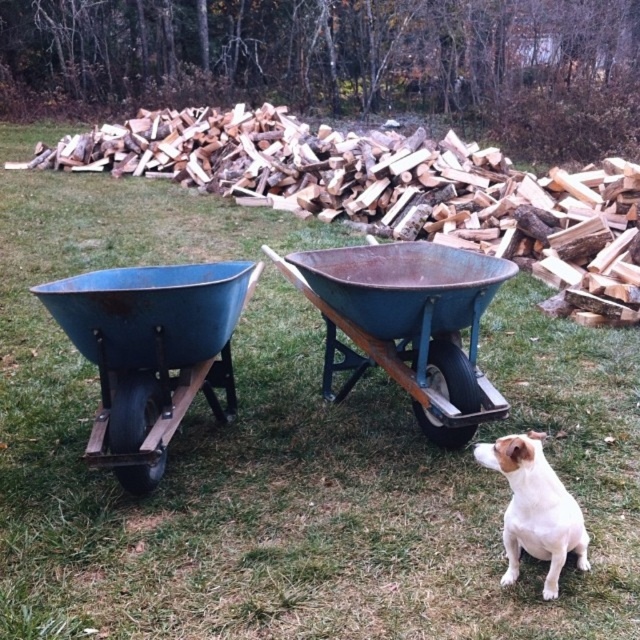
You are trying to decide which wheelbarrow to use for carrying heavy logs. Considering their sizes, which one between the blue metal wheelbarrow at left and the rusty metal wheelbarrow at center would be more suitable?

The rusty metal wheelbarrow at center has a larger width than the blue metal wheelbarrow at left, making it more suitable for carrying heavy logs due to its greater capacity.

Based on the coordinates provided, which object is located at point (392, 192) in the image?

The point (392, 192) indicates the rustic metal wheelbarrow at center.